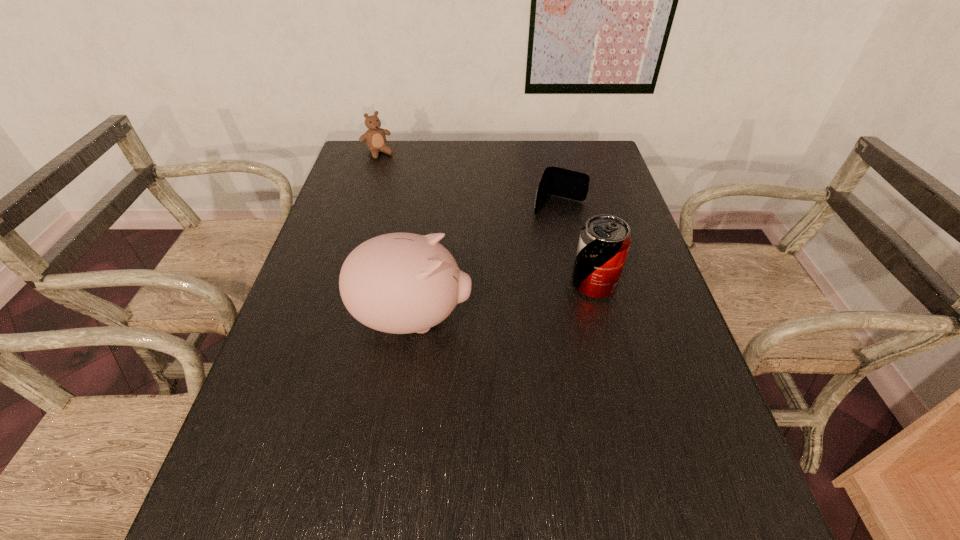
I want to click on piggy bank, so tap(400, 283).

Find the location of a particular element. This screenshot has height=540, width=960. the tallest object is located at coordinates (400, 283).

This screenshot has width=960, height=540. I want to click on the third shortest object, so click(x=604, y=242).

The width and height of the screenshot is (960, 540). In order to click on the third tallest object in this screenshot , I will do `click(375, 139)`.

The height and width of the screenshot is (540, 960). In order to click on the leftmost object in this screenshot , I will do `click(375, 139)`.

You are a GUI agent. You are given a task and a screenshot of the screen. Output one action in this format:
    pyautogui.click(x=<x>, y=<y>)
    Task: Click on the shortest object
    
    Given the screenshot: What is the action you would take?
    pyautogui.click(x=556, y=181)

I want to click on wallet, so click(556, 181).

Locate an element on the screen. This screenshot has width=960, height=540. free spot located at the snout of the second object from left to right is located at coordinates (567, 319).

Find the location of a particular element. Image resolution: width=960 pixels, height=540 pixels. blank space located 0.400m on the left of the second tallest object is located at coordinates (410, 284).

You are a GUI agent. You are given a task and a screenshot of the screen. Output one action in this format:
    pyautogui.click(x=<x>, y=<y>)
    Task: Click on the free space located on the front-facing side of the leftmost object
    This screenshot has width=960, height=540.
    Given the screenshot: What is the action you would take?
    pyautogui.click(x=425, y=208)